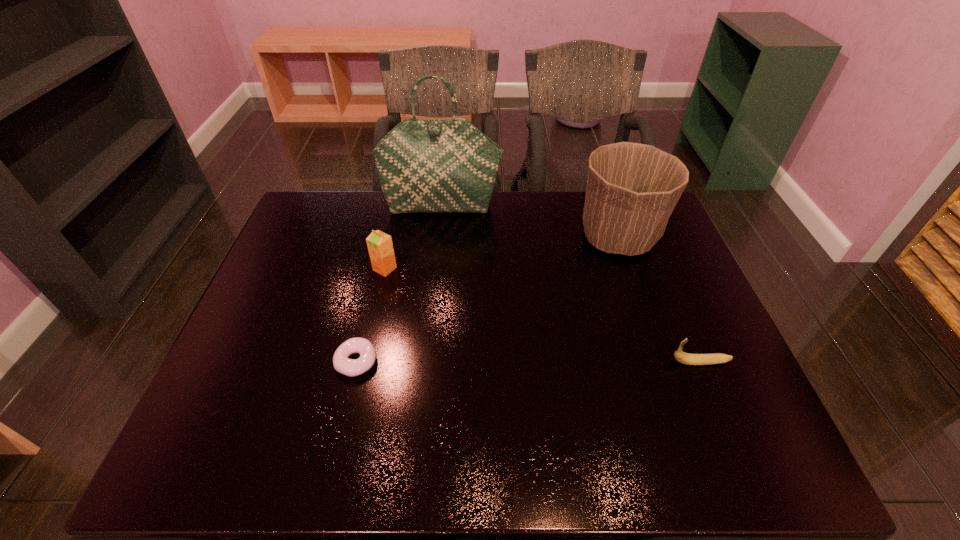
The image size is (960, 540). I want to click on tote bag, so (x=448, y=165).

Locate an element on the screen. This screenshot has height=540, width=960. flowerpot is located at coordinates click(x=632, y=189).

You are a GUI agent. You are given a task and a screenshot of the screen. Output one action in this format:
    pyautogui.click(x=<x>, y=<y>)
    Task: Click on the third shortest object
    
    Given the screenshot: What is the action you would take?
    pyautogui.click(x=380, y=246)

The width and height of the screenshot is (960, 540). Find the location of `the second shortest object`. the second shortest object is located at coordinates (685, 358).

Locate an element on the screen. the shortest object is located at coordinates (350, 367).

Find the location of a particular element. This screenshot has width=960, height=540. free spot located 0.170m on the front of the tallest object is located at coordinates (438, 251).

The image size is (960, 540). I want to click on free space located on the front of the second tallest object, so click(657, 348).

The height and width of the screenshot is (540, 960). What are the coordinates of `vacant space located 0.210m on the right of the third shortest object` in the screenshot? It's located at (468, 269).

The image size is (960, 540). What are the coordinates of `free space located 0.350m at the stem of the fourth tallest object` in the screenshot? It's located at (524, 362).

Where is `free space located at the stem of the fourth tallest object`? free space located at the stem of the fourth tallest object is located at coordinates (641, 362).